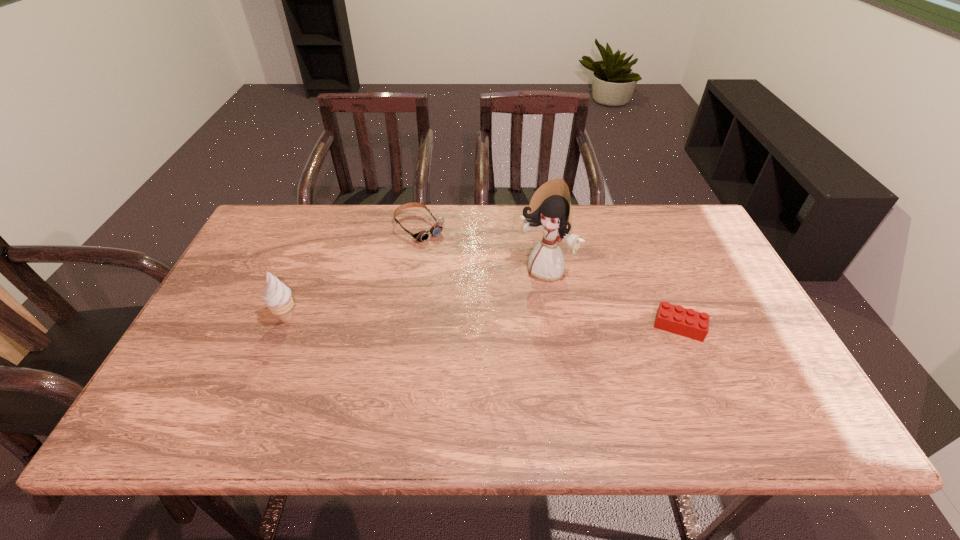
Where is `vacant spot on the desktop that is between the second tallest object and the shortest object and is positioned at the front face of the doll`? The image size is (960, 540). vacant spot on the desktop that is between the second tallest object and the shortest object and is positioned at the front face of the doll is located at coordinates (502, 323).

Locate an element on the screen. The image size is (960, 540). free spot on the desktop that is between the leftmost object and the shortest object and is positioned on the front-facing side of the farthest object is located at coordinates (526, 323).